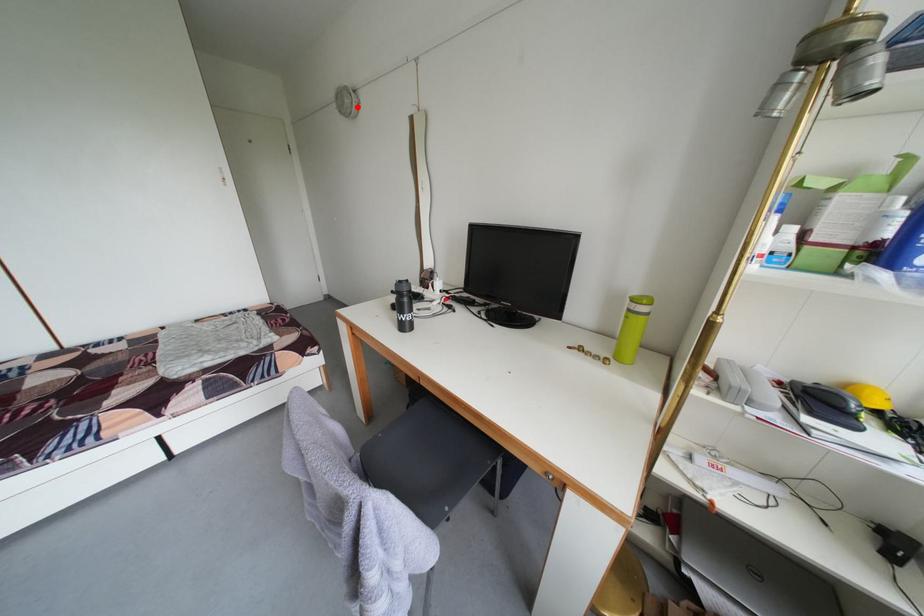
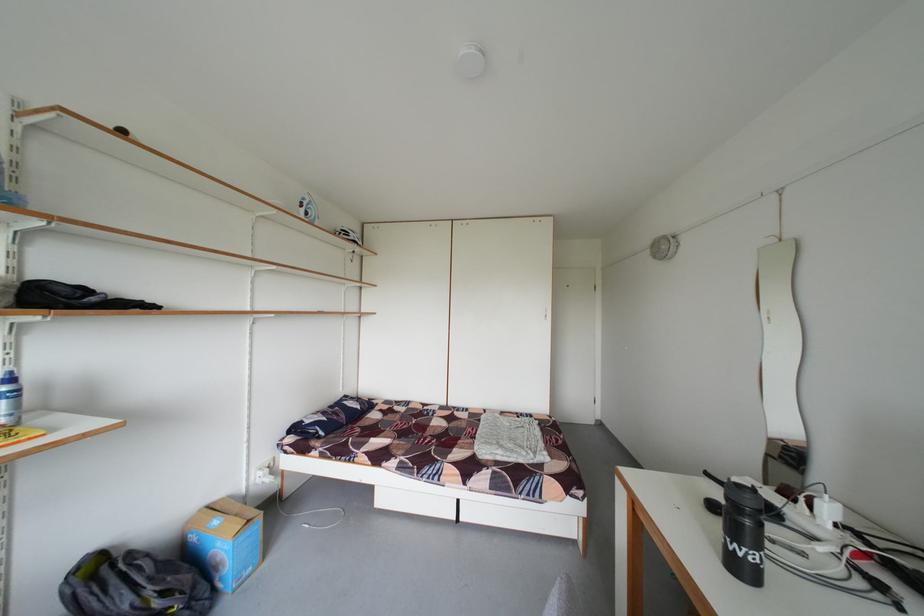
The point at the highlighted location is marked in the first image. Where is the corresponding point in the second image?

(675, 253)